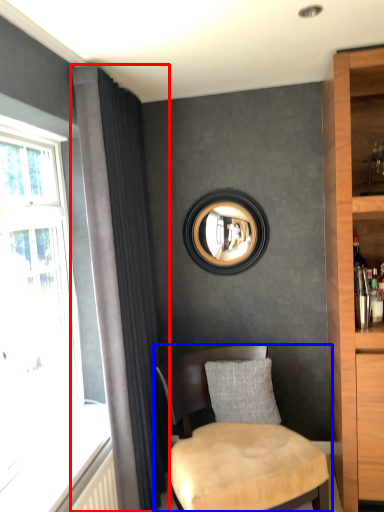
Question: Which of the following is the farthest to the observer, curtain (highlighted by a red box) or chair (highlighted by a blue box)?

Choices:
 (A) curtain
 (B) chair

Answer: (A)